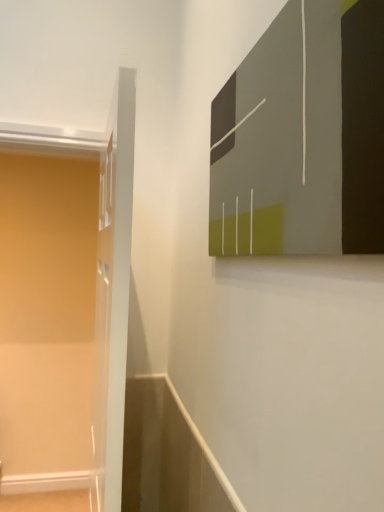
The height and width of the screenshot is (512, 384). Identify the location of matte gray bulletin board at upper right. (303, 137).

The image size is (384, 512). What do you see at coordinates (303, 137) in the screenshot?
I see `matte gray bulletin board at upper right` at bounding box center [303, 137].

Where is `matte gray bulletin board at upper right`? matte gray bulletin board at upper right is located at coordinates (303, 137).